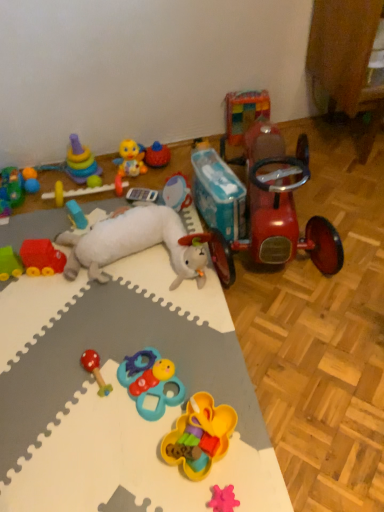
Describe the element at coordinates (243, 115) in the screenshot. I see `translucent plastic toy at upper right, which is counted as the twelfth toy, starting from the left` at that location.

Measure the distance between translucent plastic toy at upper right, which is counted as the 2th toy, starting from the right, and camera.

translucent plastic toy at upper right, which is counted as the 2th toy, starting from the right, and camera are 4.92 feet apart.

In order to face matte blue car at center-left, the 11th toy positioned from the right, should I rotate leftwards or rightwards?

Turn left approximately 15.226 degrees to face it.

The image size is (384, 512). What do you see at coordinates (12, 186) in the screenshot? I see `rubber car at left, placed as the 1th toy when sorted from left to right` at bounding box center [12, 186].

The width and height of the screenshot is (384, 512). What do you see at coordinates (76, 162) in the screenshot? I see `multicolored plastic rings at upper left, the 12th toy from the right` at bounding box center [76, 162].

Measure the distance between point (x=180, y=189) and camera.

The depth of point (x=180, y=189) is 1.78 meters.

Where is `translucent plastic toy at upper right, which is counted as the twelfth toy, starting from the left`? The height and width of the screenshot is (512, 384). translucent plastic toy at upper right, which is counted as the twelfth toy, starting from the left is located at coordinates (243, 115).

Is rubberized plastic toy at center, the tenth toy positioned from the right, far away from pink rubber bear at lower center, the 3th toy when ordered from right to left?

Yes, rubberized plastic toy at center, the tenth toy positioned from the right, is far from pink rubber bear at lower center, the 3th toy when ordered from right to left.

Would you say pink rubber bear at lower center, which is the 11th toy in left-to-right order, is part of rubberized plastic toy at center, the fourth toy from the left,'s contents?

No.

From the image's perspective, which is above, rubberized plastic toy at center, the fourth toy from the left, or pink rubber bear at lower center, which is the 11th toy in left-to-right order?

rubberized plastic toy at center, the fourth toy from the left.

Considering the relative sizes of rubber car at left, placed as the 1th toy when sorted from left to right, and white plush toy at center, the seventh toy when ordered from left to right, in the image provided, is rubber car at left, placed as the 1th toy when sorted from left to right, taller than white plush toy at center, the seventh toy when ordered from left to right,?

In fact, rubber car at left, placed as the 1th toy when sorted from left to right, may be shorter than white plush toy at center, the seventh toy when ordered from left to right.

Is rubber car at left, which is the thirteenth toy in right-to-left order, beside white plush toy at center, the 7th toy in the right-to-left sequence?

No.

Considering the positions of objects rubber car at left, which is the thirteenth toy in right-to-left order, and white plush toy at center, the 7th toy in the right-to-left sequence, in the image provided, who is more to the right, rubber car at left, which is the thirteenth toy in right-to-left order, or white plush toy at center, the 7th toy in the right-to-left sequence,?

white plush toy at center, the 7th toy in the right-to-left sequence.

Consider the image. Considering the sizes of objects blue rubber rattle at center, marked as the 8th toy in a left-to-right arrangement, and multicolored plastic rings at upper left, marked as the 2th toy in a left-to-right arrangement, in the image provided, who is wider, blue rubber rattle at center, marked as the 8th toy in a left-to-right arrangement, or multicolored plastic rings at upper left, marked as the 2th toy in a left-to-right arrangement,?

Wider between the two is blue rubber rattle at center, marked as the 8th toy in a left-to-right arrangement.

How different are the orientations of blue rubber rattle at center, marked as the 8th toy in a left-to-right arrangement, and multicolored plastic rings at upper left, marked as the 2th toy in a left-to-right arrangement, in degrees?

69.4 degrees.

Can we say blue rubber rattle at center, marked as the 8th toy in a left-to-right arrangement, lies outside multicolored plastic rings at upper left, the 12th toy from the right?

Absolutely, blue rubber rattle at center, marked as the 8th toy in a left-to-right arrangement, is external to multicolored plastic rings at upper left, the 12th toy from the right.

Find the location of a particular element. toy that is the 7th object located behind the blue rubber rattle at center, the sixth toy positioned from the right is located at coordinates (76, 162).

From the image's perspective, is yellow rubber duck at upper center, which is counted as the eighth toy, starting from the right, located above or below pink rubber bear at lower center, the 3th toy when ordered from right to left?

From the image's perspective, yellow rubber duck at upper center, which is counted as the eighth toy, starting from the right, appears above pink rubber bear at lower center, the 3th toy when ordered from right to left.

Which is in front, point (125, 152) or point (231, 485)?

The point (231, 485) is in front.

Which object is further away from the camera taking this photo, yellow rubber duck at upper center, which is counted as the eighth toy, starting from the right, or pink rubber bear at lower center, the 3th toy when ordered from right to left?

yellow rubber duck at upper center, which is counted as the eighth toy, starting from the right.

Considering the relative positions of rubberized plastic toy at center, the tenth toy positioned from the right, and plastic drum at center, the ninth toy from the left, in the image provided, is rubberized plastic toy at center, the tenth toy positioned from the right, to the left of plastic drum at center, the ninth toy from the left, from the viewer's perspective?

Correct, you'll find rubberized plastic toy at center, the tenth toy positioned from the right, to the left of plastic drum at center, the ninth toy from the left.

Considering the sizes of objects rubberized plastic toy at center, the fourth toy from the left, and plastic drum at center, the ninth toy from the left, in the image provided, who is bigger, rubberized plastic toy at center, the fourth toy from the left, or plastic drum at center, the ninth toy from the left,?

Bigger between the two is rubberized plastic toy at center, the fourth toy from the left.

Which toy is the 2nd one when counting from the back of the plastic drum at center, the fifth toy when ordered from right to left? Please provide its 2D coordinates.

[(83, 191)]

From a real-world perspective, which object stands above the other?

plastic drum at center, the fifth toy when ordered from right to left.

Who is shorter, multicolored plastic rings at upper left, marked as the 2th toy in a left-to-right arrangement, or translucent plastic toy at upper right, which is counted as the 2th toy, starting from the right?

multicolored plastic rings at upper left, marked as the 2th toy in a left-to-right arrangement.

From the picture: From a real-world perspective, is multicolored plastic rings at upper left, the 12th toy from the right, located beneath translucent plastic toy at upper right, which is counted as the twelfth toy, starting from the left?

Result: Yes, from a real-world perspective, multicolored plastic rings at upper left, the 12th toy from the right, is under translucent plastic toy at upper right, which is counted as the twelfth toy, starting from the left.

Could you tell me if multicolored plastic rings at upper left, marked as the 2th toy in a left-to-right arrangement, is turned towards translucent plastic toy at upper right, which is counted as the 2th toy, starting from the right?

No.

Consider the image. Between multicolored plastic rings at upper left, the 12th toy from the right, and translucent plastic toy at upper right, which is counted as the 2th toy, starting from the right, which one is positioned in front?

Positioned in front is multicolored plastic rings at upper left, the 12th toy from the right.

From the image's perspective, is matte blue car at center-left, arranged as the 3th toy when viewed from the left, above blue rubber rattle at center, marked as the 8th toy in a left-to-right arrangement?

Yes, from the image's perspective, matte blue car at center-left, arranged as the 3th toy when viewed from the left, is on top of blue rubber rattle at center, marked as the 8th toy in a left-to-right arrangement.

Between matte blue car at center-left, the 11th toy positioned from the right, and blue rubber rattle at center, marked as the 8th toy in a left-to-right arrangement, which one has larger width?

blue rubber rattle at center, marked as the 8th toy in a left-to-right arrangement.

Which object is positioned more to the left, matte blue car at center-left, arranged as the 3th toy when viewed from the left, or blue rubber rattle at center, the sixth toy positioned from the right?

From the viewer's perspective, matte blue car at center-left, arranged as the 3th toy when viewed from the left, appears more on the left side.

Considering the sizes of matte blue car at center-left, arranged as the 3th toy when viewed from the left, and blue rubber rattle at center, the sixth toy positioned from the right, in the image, is matte blue car at center-left, arranged as the 3th toy when viewed from the left, bigger or smaller than blue rubber rattle at center, the sixth toy positioned from the right,?

Clearly, matte blue car at center-left, arranged as the 3th toy when viewed from the left, is smaller in size than blue rubber rattle at center, the sixth toy positioned from the right.

Find the location of a particular element. The height and width of the screenshot is (512, 384). the 7th toy counting from the right of the rubberized plastic toy at center, the tenth toy positioned from the right is located at coordinates click(x=223, y=499).

There is a white plush toy at center, the 7th toy in the right-to-left sequence. Where is `the 7th toy below it (from a real-world perspective)`? The height and width of the screenshot is (512, 384). the 7th toy below it (from a real-world perspective) is located at coordinates click(12, 186).

From the picture: Based on their spatial positions, is rubber car at left, which is the thirteenth toy in right-to-left order, or shiny red tricycle at right, which is counted as the 1th toy, starting from the right, closer to translucent plastic toy at upper right, which is counted as the twelfth toy, starting from the left?

shiny red tricycle at right, which is counted as the 1th toy, starting from the right.

Based on the photo, when comparing their distances from plastic drum at center, the fifth toy when ordered from right to left, does yellow rubber duck at upper center, arranged as the sixth toy when viewed from the left, or multicolored plastic rings at upper left, marked as the 2th toy in a left-to-right arrangement, seem further?

multicolored plastic rings at upper left, marked as the 2th toy in a left-to-right arrangement.

From the image, which object appears to be nearer to pink rubber bear at lower center, the 3th toy when ordered from right to left, wooden/matte rattle at lower left, acting as the fifth toy starting from the left, or plastic drum at center, the fifth toy when ordered from right to left?

wooden/matte rattle at lower left, acting as the fifth toy starting from the left.

From the image, which object appears to be nearer to multicolored plastic rings at upper left, the 12th toy from the right, rubberized yellow flower-shaped toy at center, the 4th toy from the right, or plastic drum at center, the fifth toy when ordered from right to left?

plastic drum at center, the fifth toy when ordered from right to left, lies closer to multicolored plastic rings at upper left, the 12th toy from the right, than the other object.

In the scene shown: From the image, which object appears to be nearer to yellow rubber duck at upper center, which is counted as the eighth toy, starting from the right, rubber car at left, which is the thirteenth toy in right-to-left order, or blue rubber rattle at center, marked as the 8th toy in a left-to-right arrangement?

Among the two, rubber car at left, which is the thirteenth toy in right-to-left order, is located nearer to yellow rubber duck at upper center, which is counted as the eighth toy, starting from the right.

From the image, which object appears to be nearer to rubber car at left, which is the thirteenth toy in right-to-left order, blue rubber rattle at center, the sixth toy positioned from the right, or multicolored plastic rings at upper left, the 12th toy from the right?

multicolored plastic rings at upper left, the 12th toy from the right.

From the image, which object appears to be nearer to wooden/matte rattle at lower left, marked as the 9th toy in a right-to-left arrangement, blue rubber rattle at center, the sixth toy positioned from the right, or rubberized plastic toy at center, the tenth toy positioned from the right?

The object closer to wooden/matte rattle at lower left, marked as the 9th toy in a right-to-left arrangement, is blue rubber rattle at center, the sixth toy positioned from the right.

Estimate the real-world distances between objects in this image. Which object is closer to yellow rubber duck at upper center, arranged as the sixth toy when viewed from the left, white plush toy at center, the 7th toy in the right-to-left sequence, or plastic drum at center, the ninth toy from the left?

The object closer to yellow rubber duck at upper center, arranged as the sixth toy when viewed from the left, is plastic drum at center, the ninth toy from the left.

You are a GUI agent. You are given a task and a screenshot of the screen. Output one action in this format:
    pyautogui.click(x=<x>, y=<y>)
    Task: Click on the toy between rubber car at left, placed as the 1th toy when sorted from left to right, and matte blue car at center-left, the 11th toy positioned from the right, from left to right
    The image size is (384, 512).
    Given the screenshot: What is the action you would take?
    pyautogui.click(x=76, y=162)

Locate an element on the screen. toy between white plush toy at center, the seventh toy when ordered from left to right, and blue rubber rattle at center, the sixth toy positioned from the right, from top to bottom is located at coordinates (95, 370).

The height and width of the screenshot is (512, 384). Find the location of `toy between blue rubber rattle at center, marked as the 8th toy in a left-to-right arrangement, and pink rubber bear at lower center, which is the 11th toy in left-to-right order, vertically`. toy between blue rubber rattle at center, marked as the 8th toy in a left-to-right arrangement, and pink rubber bear at lower center, which is the 11th toy in left-to-right order, vertically is located at coordinates (199, 436).

Locate an element on the screen. Image resolution: width=384 pixels, height=512 pixels. toy between matte blue car at center-left, arranged as the 3th toy when viewed from the left, and wooden/matte rattle at lower left, marked as the 9th toy in a right-to-left arrangement, in the vertical direction is located at coordinates (133, 244).